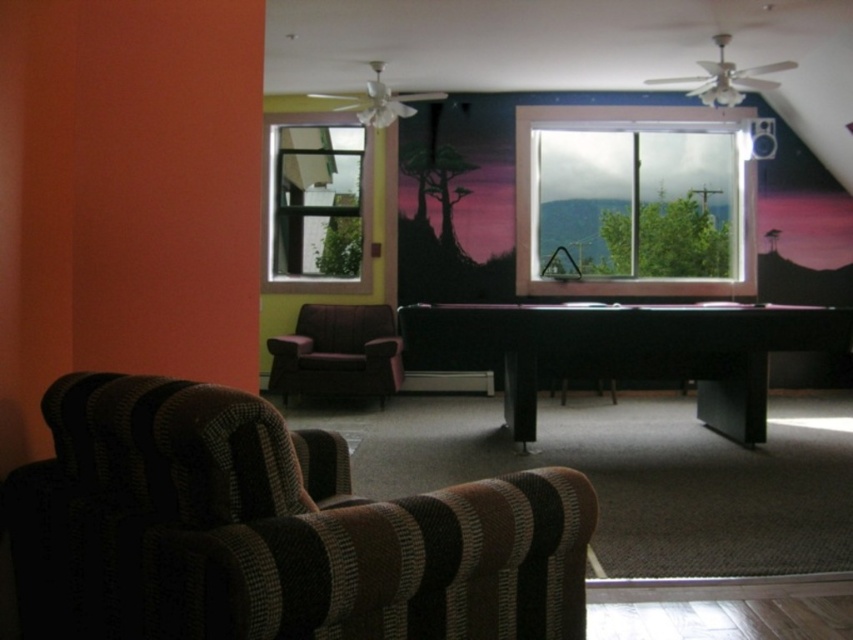
You are planning to place a new sofa in this room. The sofa is 2 meters long. The black felt pool table at center is currently occupying space in the middle. Can the sofa be placed in the area where the clear glass window at upper left is located?

The black felt pool table at center has a larger size compared to clear glass window at upper left. Since the clear glass window at upper left is smaller, the 2 meter long sofa may not fit there. Consider placing the sofa elsewhere in the room where there is more space.

You are planning to place a large potted plant between the striped fabric couch at lower left and the clear glass window at center. Considering their sizes, which object should the plant be closer to?

The striped fabric couch at lower left has a smaller size compared to the clear glass window at center, so the plant should be closer to the clear glass window at center to balance the space.